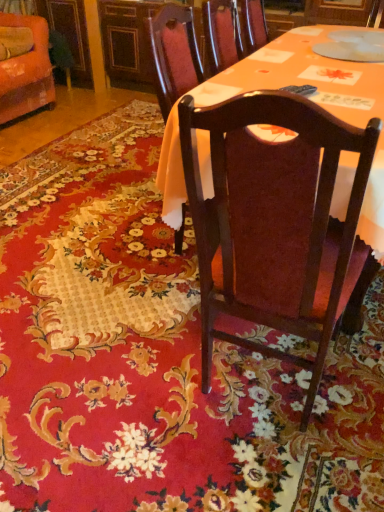
You are a GUI agent. You are given a task and a screenshot of the screen. Output one action in this format:
    pyautogui.click(x=<x>, y=<y>)
    Task: Click on the vacant space in front of matte wood table at center
    
    Given the screenshot: What is the action you would take?
    pyautogui.click(x=165, y=313)